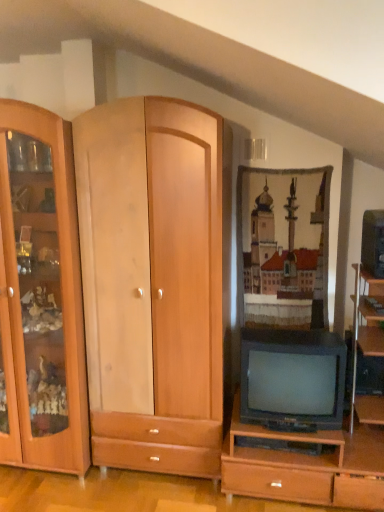
This screenshot has height=512, width=384. What do you see at coordinates (373, 243) in the screenshot?
I see `matte black television at right, placed as the second television when sorted from bottom to top` at bounding box center [373, 243].

Identify the location of matte black television at right, placed as the second television when sorted from bottom to top. (373, 243).

The width and height of the screenshot is (384, 512). Describe the element at coordinates (292, 376) in the screenshot. I see `matte black television at center, placed as the first television when sorted from left to right` at that location.

Identify the location of matte black television at center, the second television when ordered from right to left. The width and height of the screenshot is (384, 512). (292, 376).

The image size is (384, 512). In order to click on matte black television at right, which is the 1th television from top to bottom in this screenshot , I will do `click(373, 243)`.

Considering the positions of objects matte black television at center, acting as the 1th television starting from the bottom, and matte black television at right, acting as the first television starting from the right, in the image provided, who is more to the left, matte black television at center, acting as the 1th television starting from the bottom, or matte black television at right, acting as the first television starting from the right,?

Positioned to the left is matte black television at center, acting as the 1th television starting from the bottom.

Considering their positions, is matte black television at center, placed as the first television when sorted from left to right, located in front of or behind matte black television at right, acting as the first television starting from the right?

matte black television at center, placed as the first television when sorted from left to right, is positioned farther from the viewer than matte black television at right, acting as the first television starting from the right.

Considering the points (275, 403) and (366, 256), which point is behind, point (275, 403) or point (366, 256)?

The point (366, 256) is farther from the camera.

From the image's perspective, is matte black television at center, the second television when ordered from right to left, above matte black television at right, acting as the first television starting from the right?

No, from the image's perspective, matte black television at center, the second television when ordered from right to left, is not over matte black television at right, acting as the first television starting from the right.

From a real-world perspective, relative to matte black television at right, which is the 1th television from top to bottom, is matte black television at center, acting as the 1th television starting from the bottom, vertically above or below?

matte black television at center, acting as the 1th television starting from the bottom, is below matte black television at right, which is the 1th television from top to bottom.

Considering the sizes of objects matte black television at center, acting as the 1th television starting from the bottom, and matte black television at right, placed as the second television when sorted from bottom to top, in the image provided, who is wider, matte black television at center, acting as the 1th television starting from the bottom, or matte black television at right, placed as the second television when sorted from bottom to top,?

Wider between the two is matte black television at center, acting as the 1th television starting from the bottom.

Considering the sizes of objects matte black television at center, acting as the 1th television starting from the bottom, and matte black television at right, which is the 1th television from top to bottom, in the image provided, who is taller, matte black television at center, acting as the 1th television starting from the bottom, or matte black television at right, which is the 1th television from top to bottom,?

matte black television at center, acting as the 1th television starting from the bottom, is taller.

Consider the image. Can you confirm if matte black television at center, the 2th television positioned from the top, is smaller than matte black television at right, acting as the first television starting from the right?

Incorrect, matte black television at center, the 2th television positioned from the top, is not smaller in size than matte black television at right, acting as the first television starting from the right.

Can matte black television at right, which is the 1th television from top to bottom, be found inside matte black television at center, placed as the first television when sorted from left to right?

No, matte black television at right, which is the 1th television from top to bottom, is not surrounded by matte black television at center, placed as the first television when sorted from left to right.

Is matte black television at center, placed as the first television when sorted from left to right, positioned far away from matte black television at right, placed as the second television when sorted from bottom to top?

No.

Is matte black television at center, the 2th television positioned from the top, positioned with its back to matte black television at right, placed as the second television when sorted from bottom to top?

No, matte black television at center, the 2th television positioned from the top,'s orientation is not away from matte black television at right, placed as the second television when sorted from bottom to top.

Can you tell me how much matte black television at center, the 2th television positioned from the top, and matte black television at right, acting as the first television starting from the right, differ in facing direction?

The facing directions of matte black television at center, the 2th television positioned from the top, and matte black television at right, acting as the first television starting from the right, are 1.59 degrees apart.

The width and height of the screenshot is (384, 512). Find the location of `television below the matte black television at right, placed as the second television when sorted from bottom to top (from the image's perspective)`. television below the matte black television at right, placed as the second television when sorted from bottom to top (from the image's perspective) is located at coordinates (292, 376).

Between matte black television at right, acting as the first television starting from the right, and matte black television at center, the second television when ordered from right to left, which one appears on the right side from the viewer's perspective?

From the viewer's perspective, matte black television at right, acting as the first television starting from the right, appears more on the right side.

Between matte black television at right, which is the 1th television from top to bottom, and matte black television at center, placed as the first television when sorted from left to right, which one is positioned behind?

matte black television at center, placed as the first television when sorted from left to right, is further away from the camera.

Considering the points (361, 254) and (307, 352), which point is in front, point (361, 254) or point (307, 352)?

Point (307, 352)

From the image's perspective, is matte black television at right, acting as the first television starting from the right, located beneath matte black television at center, acting as the 1th television starting from the bottom?

No.

From a real-world perspective, is matte black television at right, placed as the second television when sorted from bottom to top, located beneath matte black television at center, the second television when ordered from right to left?

No, from a real-world perspective, matte black television at right, placed as the second television when sorted from bottom to top, is not beneath matte black television at center, the second television when ordered from right to left.

Considering the sizes of objects matte black television at right, acting as the first television starting from the right, and matte black television at center, the 2th television positioned from the top, in the image provided, who is wider, matte black television at right, acting as the first television starting from the right, or matte black television at center, the 2th television positioned from the top,?

matte black television at center, the 2th television positioned from the top, is wider.

From their relative heights in the image, would you say matte black television at right, acting as the second television starting from the left, is taller or shorter than matte black television at center, acting as the 1th television starting from the bottom?

In the image, matte black television at right, acting as the second television starting from the left, appears to be shorter than matte black television at center, acting as the 1th television starting from the bottom.

Can you confirm if matte black television at right, which is the 1th television from top to bottom, is bigger than matte black television at center, the 2th television positioned from the top?

No, matte black television at right, which is the 1th television from top to bottom, is not bigger than matte black television at center, the 2th television positioned from the top.

Is matte black television at right, placed as the second television when sorted from bottom to top, surrounding matte black television at center, acting as the 1th television starting from the bottom?

No.

Is matte black television at right, acting as the second television starting from the left, touching matte black television at center, the 2th television positioned from the top?

They are not placed beside each other.

Is matte black television at right, placed as the second television when sorted from bottom to top, facing towards matte black television at center, acting as the 1th television starting from the bottom?

No, matte black television at right, placed as the second television when sorted from bottom to top, is not oriented towards matte black television at center, acting as the 1th television starting from the bottom.

How different are the orientations of matte black television at right, which is the 1th television from top to bottom, and matte black television at center, acting as the 1th television starting from the bottom, in degrees?

1.59 degrees separate the facing orientations of matte black television at right, which is the 1th television from top to bottom, and matte black television at center, acting as the 1th television starting from the bottom.

There is a matte black television at center, the second television when ordered from right to left. Where is `television above it (from a real-world perspective)`? television above it (from a real-world perspective) is located at coordinates (373, 243).

Find the location of a particular element. television directly beneath the matte black television at right, placed as the second television when sorted from bottom to top (from a real-world perspective) is located at coordinates (292, 376).

Locate an element on the screen. The width and height of the screenshot is (384, 512). television in front of the matte black television at center, placed as the first television when sorted from left to right is located at coordinates (373, 243).